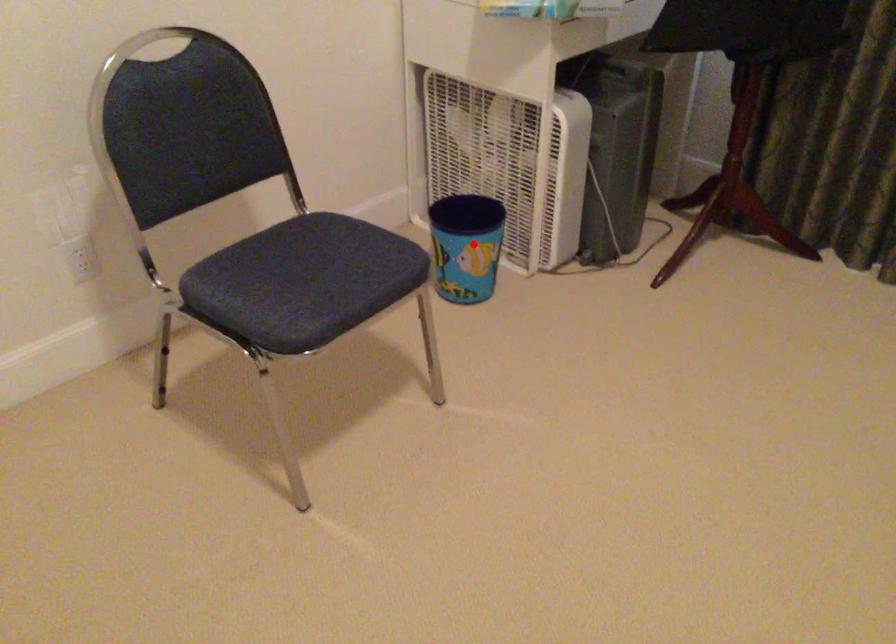
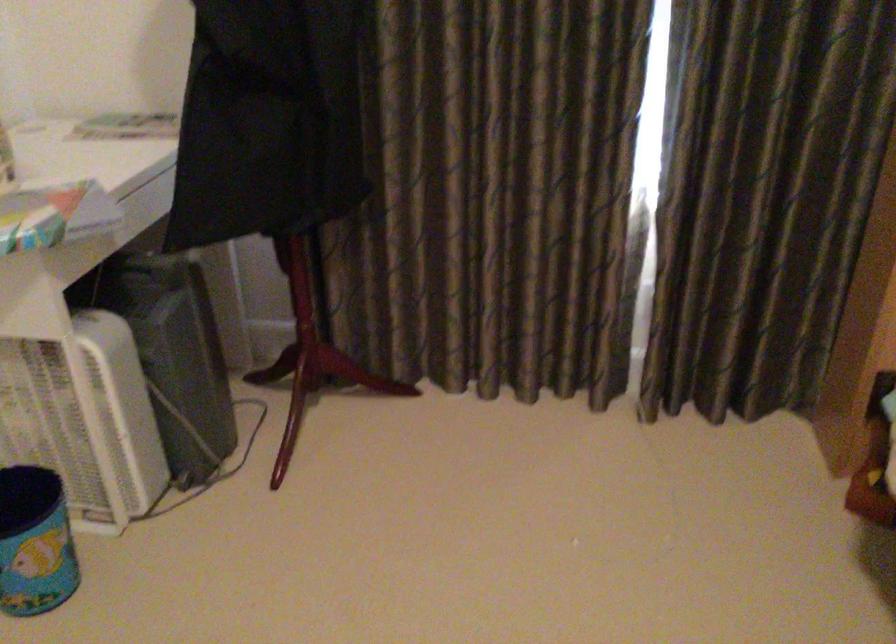
Question: I am providing you with two images of the same scene from different viewpoints. A red point is shown in image1. For the corresponding object point in image2, is it positioned nearer or farther from the camera?

Choices:
 (A) Nearer
 (B) Farther

Answer: (A)